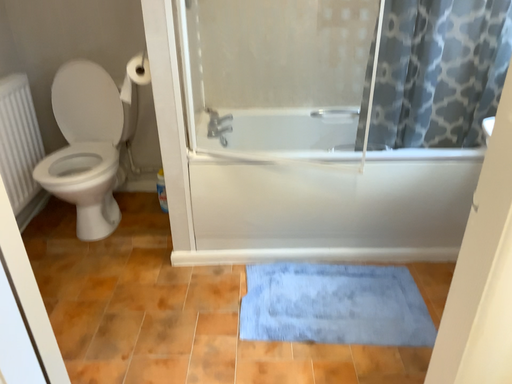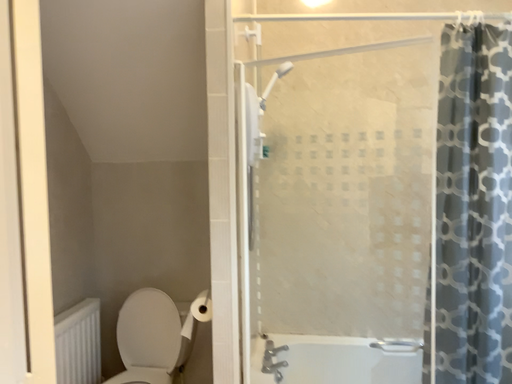
Question: Which way did the camera rotate in the video?

Choices:
 (A) rotated upward
 (B) rotated downward

Answer: (A)